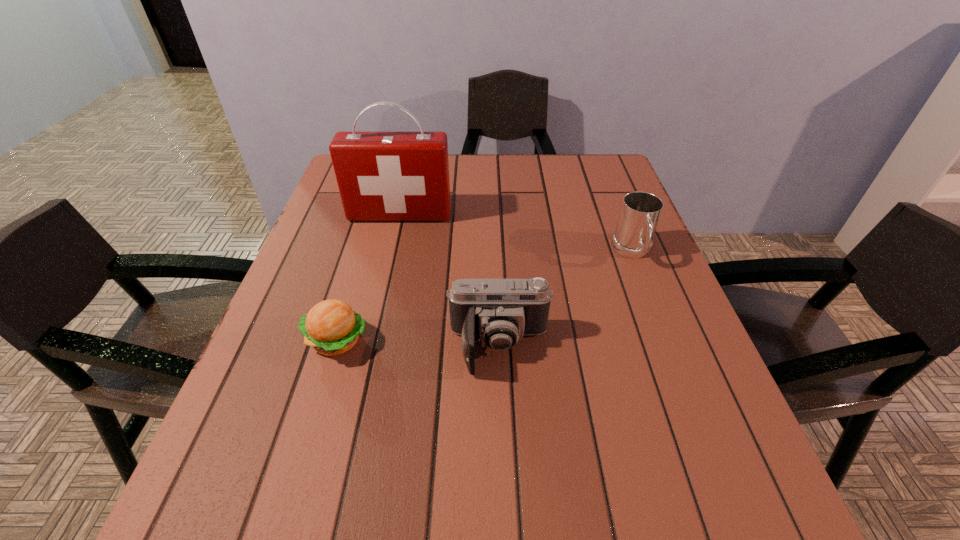
You are a GUI agent. You are given a task and a screenshot of the screen. Output one action in this format:
    pyautogui.click(x=<x>, y=<y>)
    Task: Click on the first-aid kit present at the left edge
    This screenshot has width=960, height=540.
    Given the screenshot: What is the action you would take?
    pyautogui.click(x=382, y=176)

The height and width of the screenshot is (540, 960). I want to click on hamburger at the left edge, so click(331, 327).

I want to click on object that is at the right edge, so click(x=640, y=211).

This screenshot has width=960, height=540. In the image, there is a desktop. Identify the location of vacant space at the left edge. (329, 250).

Where is `vacant space at the right edge of the desktop`? The height and width of the screenshot is (540, 960). vacant space at the right edge of the desktop is located at coordinates (601, 273).

Locate an element on the screen. This screenshot has width=960, height=540. free space between the farthest object and the hamburger is located at coordinates (369, 278).

Locate an element on the screen. The height and width of the screenshot is (540, 960). vacant area that lies between the shortest object and the farthest object is located at coordinates (369, 278).

The height and width of the screenshot is (540, 960). In order to click on free space between the tallest object and the second object from right to left in this screenshot , I will do `click(449, 281)`.

I want to click on unoccupied position between the camera and the first-aid kit, so click(449, 281).

Identify the location of free spot between the camera and the farthest object. (449, 281).